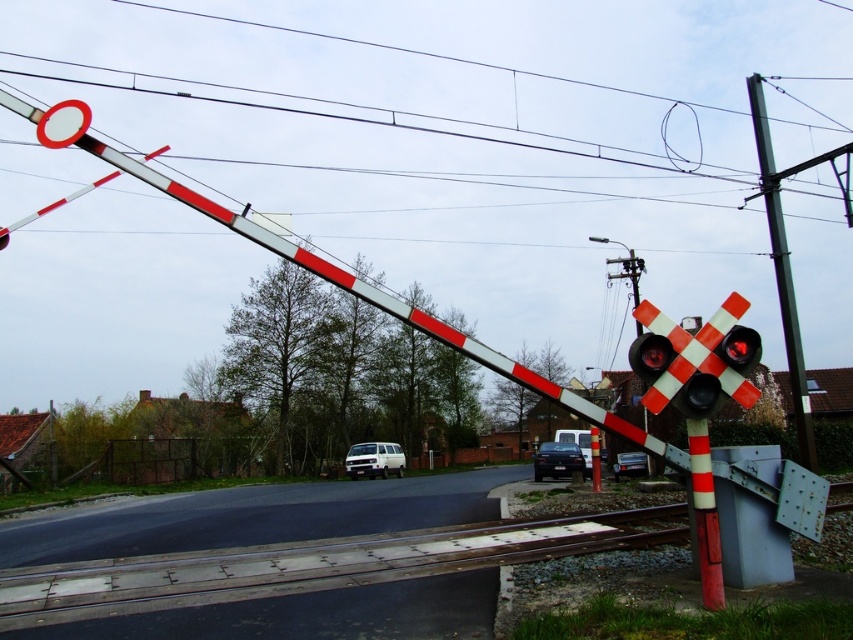
Question: Which of the following is the closest to the observer?

Choices:
 (A) metallic black car at center
 (B) white painted metal power line at upper center

Answer: (A)

Question: Can you confirm if smooth metal train track at center is positioned above white matte van at center?

Choices:
 (A) yes
 (B) no

Answer: (A)

Question: Which of these objects is positioned farthest from the metallic black car at center?

Choices:
 (A) red and white striped traffic light at center
 (B) smooth metal train track at center
 (C) white matte van at center

Answer: (A)

Question: Where is white glossy circle at upper left located in relation to white matte van at center in the image?

Choices:
 (A) above
 (B) below

Answer: (A)

Question: Is smooth metal train track at center above white painted metal power line at upper center?

Choices:
 (A) yes
 (B) no

Answer: (B)

Question: Among these points, which one is farthest from the camera?

Choices:
 (A) (44, 120)
 (B) (532, 474)
 (C) (596, 477)

Answer: (B)